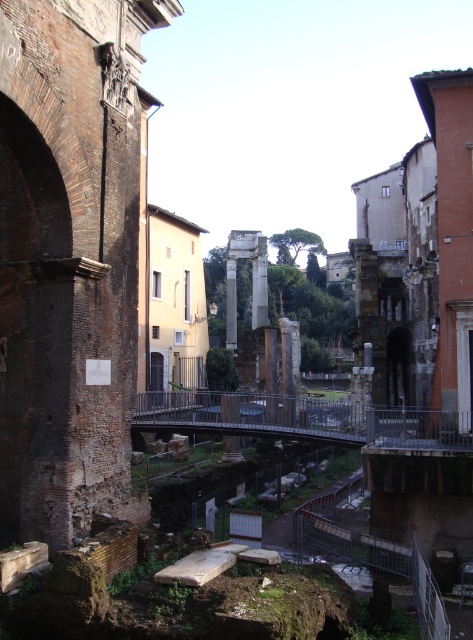
Looking at this image, does brick wall at left have a smaller size compared to white marble pillar at center?

Yes, brick wall at left is smaller than white marble pillar at center.

Is brick wall at left thinner than white marble pillar at center?

No.

Locate an element on the screen. brick wall at left is located at coordinates (69, 259).